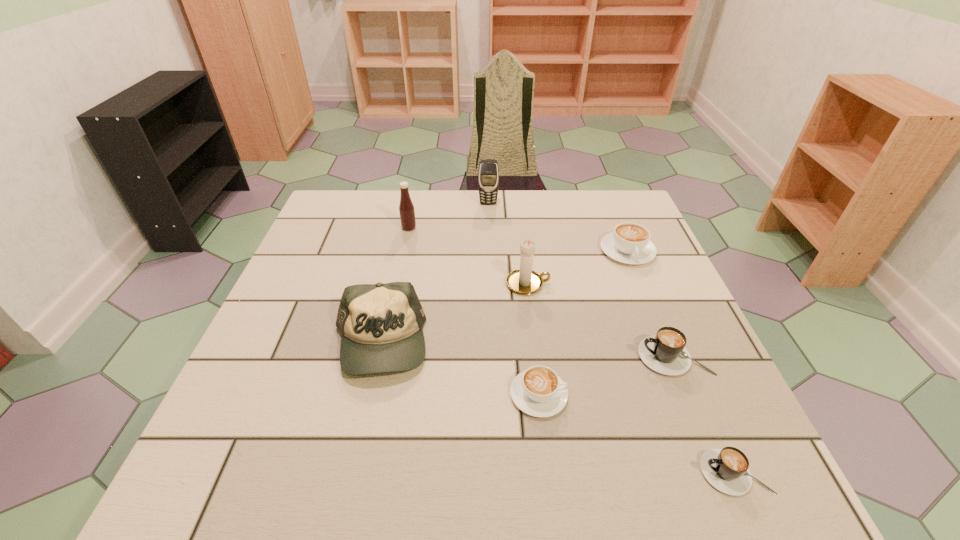
Locate an element on the screen. The height and width of the screenshot is (540, 960). free region located with the handle on the side of the farther black cappuccino is located at coordinates (473, 356).

Locate an element on the screen. The image size is (960, 540). free point located with the handle on the side of the farther black cappuccino is located at coordinates (565, 356).

What are the coordinates of `free region located 0.080m with the handle on the side of the farther black cappuccino` in the screenshot? It's located at (600, 356).

This screenshot has height=540, width=960. What are the coordinates of `blank area located on the side of the smaller white cappuccino with the handle` in the screenshot? It's located at (678, 395).

I want to click on vacant area situated with the handle on the side of the smaller black cappuccino, so click(x=616, y=472).

Where is `free space located 0.290m with the handle on the side of the smaller black cappuccino`? The width and height of the screenshot is (960, 540). free space located 0.290m with the handle on the side of the smaller black cappuccino is located at coordinates (525, 472).

This screenshot has height=540, width=960. I want to click on vacant space located 0.400m with the handle on the side of the smaller black cappuccino, so click(x=458, y=472).

Identify the location of cellular telephone present at the far edge. (488, 177).

Locate an element on the screen. The width and height of the screenshot is (960, 540). Tabasco sauce located in the far edge section of the desktop is located at coordinates (406, 208).

Where is `cappuccino that is positioned at the far edge`? Image resolution: width=960 pixels, height=540 pixels. cappuccino that is positioned at the far edge is located at coordinates (629, 243).